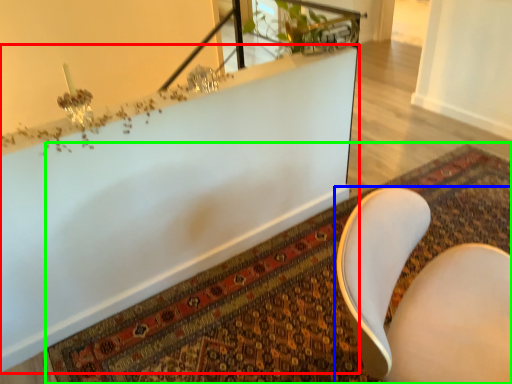
Question: Considering the real-world distances, which object is closest to bathtub (highlighted by a red box)? chair (highlighted by a blue box) or mat (highlighted by a green box).

Choices:
 (A) chair
 (B) mat

Answer: (B)